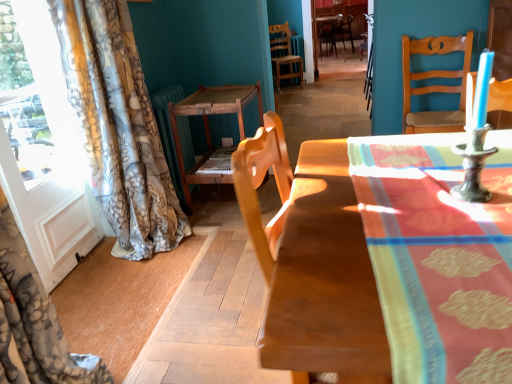
The height and width of the screenshot is (384, 512). In order to click on vacant area in front of metallic candle holder at right in this screenshot , I will do `click(473, 228)`.